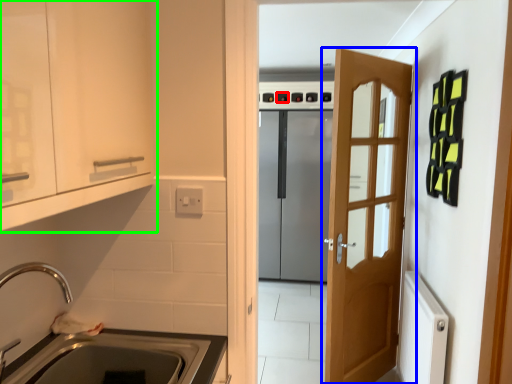
Question: Which object is positioned farthest from knob (highlighted by a red box)? Select from door (highlighted by a blue box) and cabinetry (highlighted by a green box).

Choices:
 (A) door
 (B) cabinetry

Answer: (B)